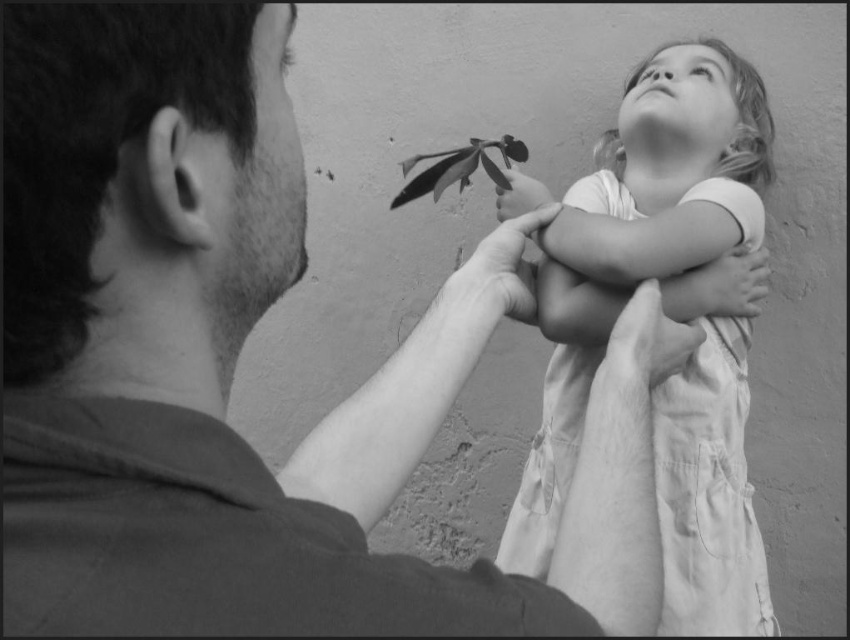
Is point (683, 264) more distant than point (473, 161)?

No.

Who is positioned more to the left, white cotton dress at upper right or smooth glossy leaf at upper center?

Positioned to the left is smooth glossy leaf at upper center.

Is point (575, 292) positioned in front of point (451, 150)?

Yes, point (575, 292) is closer to viewer.

This screenshot has height=640, width=850. Find the location of `white cotton dress at upper right`. white cotton dress at upper right is located at coordinates (639, 244).

Can you confirm if smooth skin at upper center is taller than smooth glossy leaf at upper center?

Yes, smooth skin at upper center is taller than smooth glossy leaf at upper center.

Describe the element at coordinates (414, 384) in the screenshot. I see `smooth skin at upper center` at that location.

The height and width of the screenshot is (640, 850). I want to click on smooth skin at upper center, so click(414, 384).

Is point (690, 605) positioned in front of point (374, 506)?

No, it is not.

Does white cotton dress at upper right come in front of smooth skin at upper center?

No, white cotton dress at upper right is further to the viewer.

Is point (613, 134) closer to camera compared to point (459, 348)?

No, (613, 134) is behind (459, 348).

At what (x,y) coordinates should I click in order to perform the action: click on white cotton dress at upper right. Please return your answer as a coordinate pair (x, y). This screenshot has width=850, height=640. Looking at the image, I should click on (639, 244).